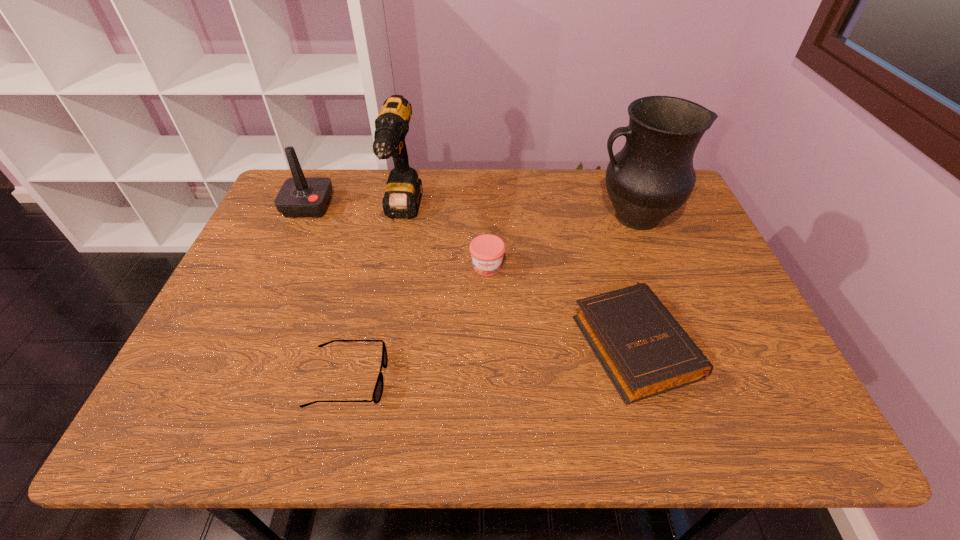
In the image, there is a desktop. Identify the location of free space at the near left corner. This screenshot has width=960, height=540. (202, 401).

What are the coordinates of `unoccupied position between the jam and the shortest object` in the screenshot? It's located at (418, 322).

The height and width of the screenshot is (540, 960). What are the coordinates of `unoccupied area between the pitcher and the fourth farthest object` in the screenshot? It's located at (561, 241).

At what (x,y) coordinates should I click in order to perform the action: click on unoccupied position between the fourth shortest object and the Bible. Please return your answer as a coordinate pair (x, y). Looking at the image, I should click on (471, 274).

Where is `blank region between the pitcher and the spectacles`? blank region between the pitcher and the spectacles is located at coordinates (492, 298).

This screenshot has width=960, height=540. I want to click on free space between the third shortest object and the second shortest object, so click(x=561, y=304).

Image resolution: width=960 pixels, height=540 pixels. I want to click on free area in between the shortest object and the Bible, so click(x=492, y=360).

You are a GUI agent. You are given a task and a screenshot of the screen. Output one action in this format:
    pyautogui.click(x=<x>, y=<y>)
    Task: Click on the empty space between the third shortest object and the leftmost object
    The width and height of the screenshot is (960, 540).
    Given the screenshot: What is the action you would take?
    pyautogui.click(x=397, y=236)

Find the location of a particular element. The width and height of the screenshot is (960, 540). free spot between the pitcher and the drill is located at coordinates (518, 215).

Locate an element on the screen. This screenshot has height=540, width=960. unoccupied position between the Bible and the spectacles is located at coordinates (492, 360).